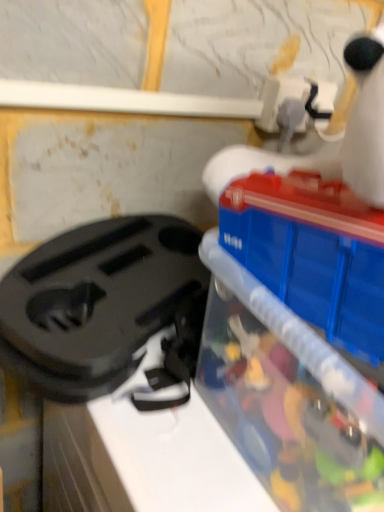
Describe the element at coordinates (294, 339) in the screenshot. This screenshot has width=384, height=512. I see `translucent plastic container at right` at that location.

Image resolution: width=384 pixels, height=512 pixels. I want to click on translucent plastic container at right, so click(x=294, y=339).

The width and height of the screenshot is (384, 512). What do you see at coordinates (105, 308) in the screenshot?
I see `black plastic bag at left` at bounding box center [105, 308].

Identify the location of black plastic bag at left. (105, 308).

Find the location of a particular element. translucent plastic container at right is located at coordinates (294, 339).

Considering the positions of objects black plastic bag at left and translucent plastic container at right in the image provided, who is more to the right, black plastic bag at left or translucent plastic container at right?

Positioned to the right is translucent plastic container at right.

Which object is more forward, black plastic bag at left or translucent plastic container at right?

Positioned in front is translucent plastic container at right.

Between point (115, 253) and point (382, 260), which one is positioned behind?

Point (115, 253)

From the image's perspective, which one is positioned higher, black plastic bag at left or translucent plastic container at right?

black plastic bag at left.

From a real-world perspective, is black plastic bag at left physically above translucent plastic container at right?

No, from a real-world perspective, black plastic bag at left is not on top of translucent plastic container at right.

Which of these two, black plastic bag at left or translucent plastic container at right, is thinner?

black plastic bag at left.

Does black plastic bag at left have a lesser height compared to translucent plastic container at right?

Yes, black plastic bag at left is shorter than translucent plastic container at right.

Does black plastic bag at left have a larger size compared to translucent plastic container at right?

Incorrect, black plastic bag at left is not larger than translucent plastic container at right.

Would you say black plastic bag at left is inside or outside translucent plastic container at right?

black plastic bag at left cannot be found inside translucent plastic container at right.

Can you see black plastic bag at left touching translucent plastic container at right?

No, black plastic bag at left is not in contact with translucent plastic container at right.

Is black plastic bag at left facing towards translucent plastic container at right?

No, black plastic bag at left is not facing towards translucent plastic container at right.

What's the angular difference between black plastic bag at left and translucent plastic container at right's facing directions?

There is a 4.33e-05-degree angle between the facing directions of black plastic bag at left and translucent plastic container at right.

You are a GUI agent. You are given a task and a screenshot of the screen. Output one action in this format:
    pyautogui.click(x=<x>, y=<y>)
    Task: Click on the appliance behind the translucent plastic container at right
    
    Given the screenshot: What is the action you would take?
    pyautogui.click(x=105, y=308)

Between translucent plastic container at right and black plastic bag at left, which one appears on the left side from the viewer's perspective?

From the viewer's perspective, black plastic bag at left appears more on the left side.

Which is in front, translucent plastic container at right or black plastic bag at left?

translucent plastic container at right is closer to the camera.

Which is closer, (331,207) or (100,225)?

Point (331,207).

From the image's perspective, is translucent plastic container at right located above or below black plastic bag at left?

Clearly, from the image's perspective, translucent plastic container at right is below black plastic bag at left.

From a real-world perspective, who is located higher, translucent plastic container at right or black plastic bag at left?

translucent plastic container at right.

Between translucent plastic container at right and black plastic bag at left, which one has smaller width?

black plastic bag at left.

Which of these two, translucent plastic container at right or black plastic bag at left, stands taller?

translucent plastic container at right is taller.

Which of these two, translucent plastic container at right or black plastic bag at left, is bigger?

Bigger between the two is translucent plastic container at right.

Can we say translucent plastic container at right lies outside black plastic bag at left?

translucent plastic container at right lies outside black plastic bag at left's area.

Is translucent plastic container at right not close to black plastic bag at left?

Actually, translucent plastic container at right and black plastic bag at left are a little close together.

Is translucent plastic container at right aimed at black plastic bag at left?

No, translucent plastic container at right is not aimed at black plastic bag at left.

Measure the distance from translucent plastic container at right to black plastic bag at left.

translucent plastic container at right and black plastic bag at left are 7.08 inches apart from each other.

This screenshot has height=512, width=384. In the image, there is a black plastic bag at left. What are the coordinates of `toy below it (from the image's perspective)` in the screenshot? It's located at (294, 339).

Find the location of a particular element. This screenshot has height=512, width=384. toy in front of the black plastic bag at left is located at coordinates (294, 339).

The image size is (384, 512). Identify the location of toy below the black plastic bag at left (from the image's perspective). (294, 339).